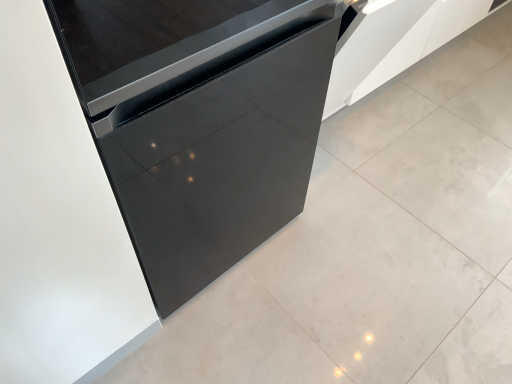
Find the location of a particular element. matte black dishwasher at center is located at coordinates coord(201,121).

The image size is (512, 384). What do you see at coordinates (201, 121) in the screenshot?
I see `matte black dishwasher at center` at bounding box center [201, 121].

I want to click on matte black dishwasher at center, so click(201, 121).